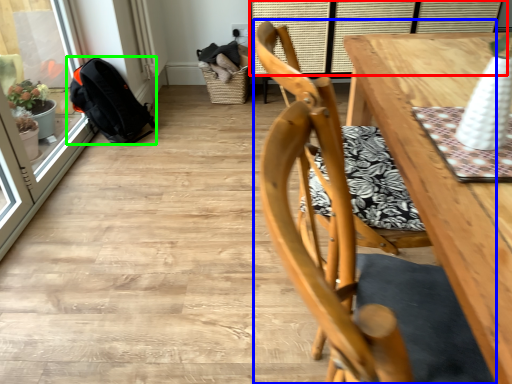
Question: Based on their relative distances, which object is nearer to window (highlighted by a red box)? Choose from chair (highlighted by a blue box) and backpack (highlighted by a green box).

Choices:
 (A) chair
 (B) backpack

Answer: (B)